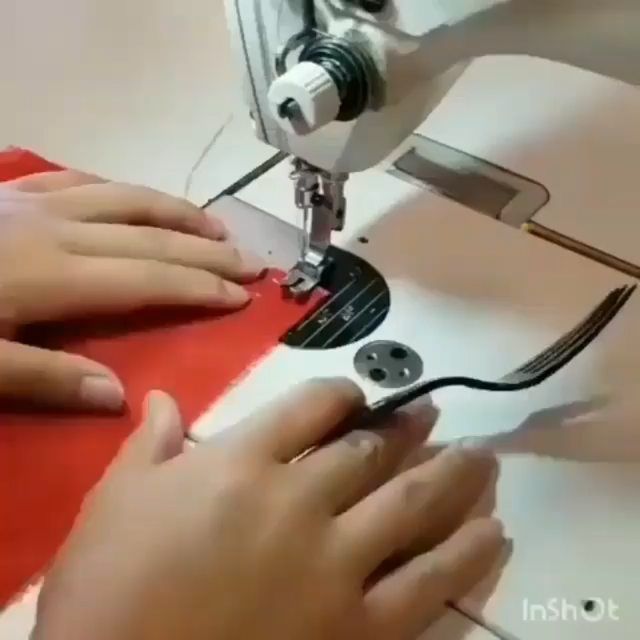
You are a GUI agent. You are given a task and a screenshot of the screen. Output one action in this format:
    pyautogui.click(x=<x>, y=<y>)
    Task: Click on the sewing machine bed
    The width and height of the screenshot is (640, 640).
    Given the screenshot: What is the action you would take?
    pyautogui.click(x=518, y=292)